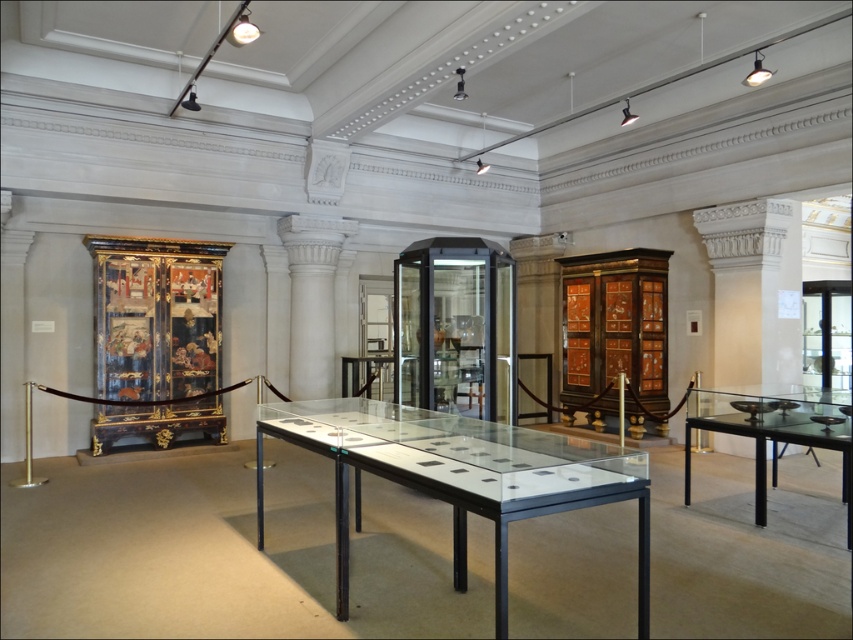
Question: Can you confirm if clear glass table at center is smaller than black glass table at right?

Choices:
 (A) yes
 (B) no

Answer: (B)

Question: In this image, where is clear glass table at center located relative to black glass table at right?

Choices:
 (A) left
 (B) right

Answer: (A)

Question: Which object appears closest to the camera in this image?

Choices:
 (A) black glass table at right
 (B) clear glass table at center

Answer: (B)

Question: Is clear glass table at center closer to the viewer compared to black glass table at right?

Choices:
 (A) no
 (B) yes

Answer: (B)

Question: Which point is farther from the camera taking this photo?

Choices:
 (A) (357, 518)
 (B) (816, 435)

Answer: (A)